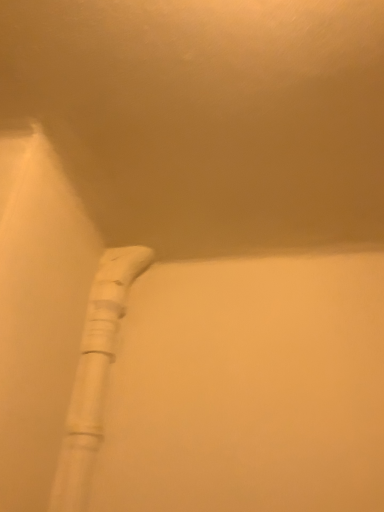
Locate an element on the screen. white textured shower at center is located at coordinates (94, 375).

Describe the element at coordinates (94, 375) in the screenshot. I see `white textured shower at center` at that location.

I want to click on white textured shower at center, so click(94, 375).